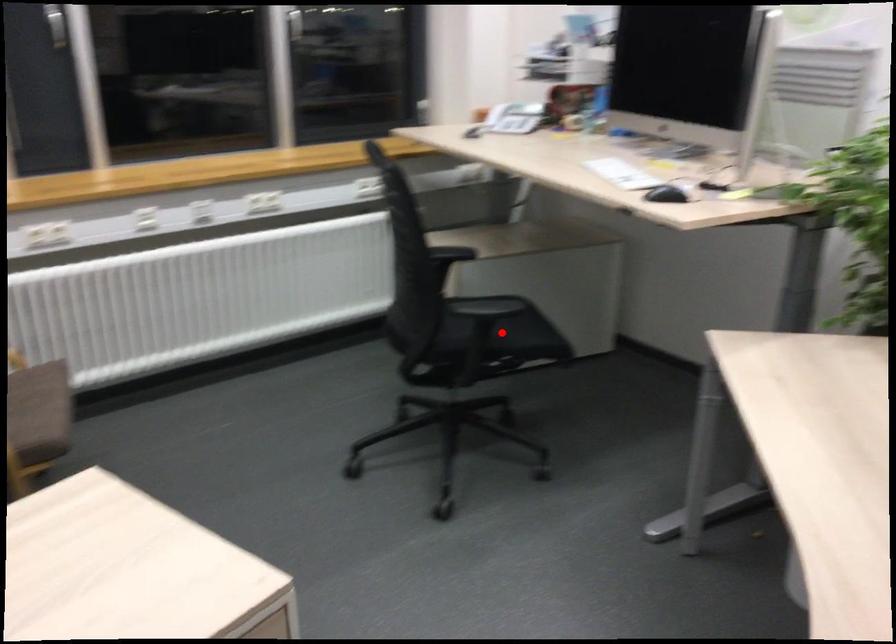
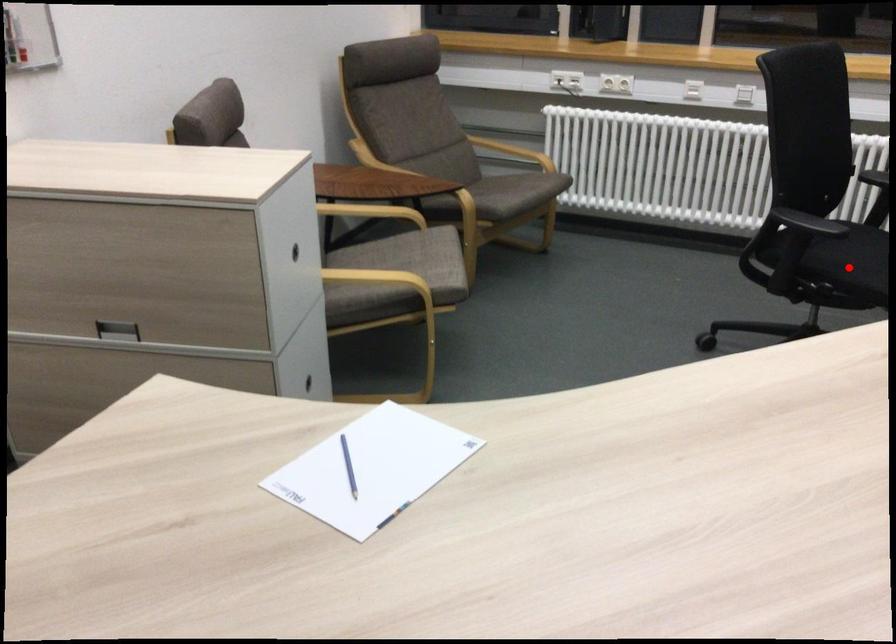
I am providing you with two images of the same scene from different viewpoints. A red point is marked on the first image and another point is marked on the second image. Does the point marked in image1 correspond to the same location as the one in image2?

Yes